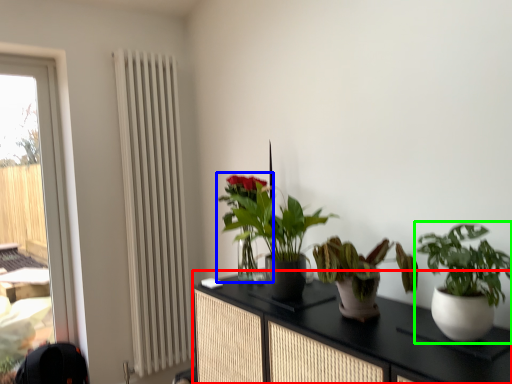
Question: Which object is positioned farthest from cabinetry (highlighted by a red box)? Select from houseplant (highlighted by a blue box) and houseplant (highlighted by a green box).

Choices:
 (A) houseplant
 (B) houseplant

Answer: (A)